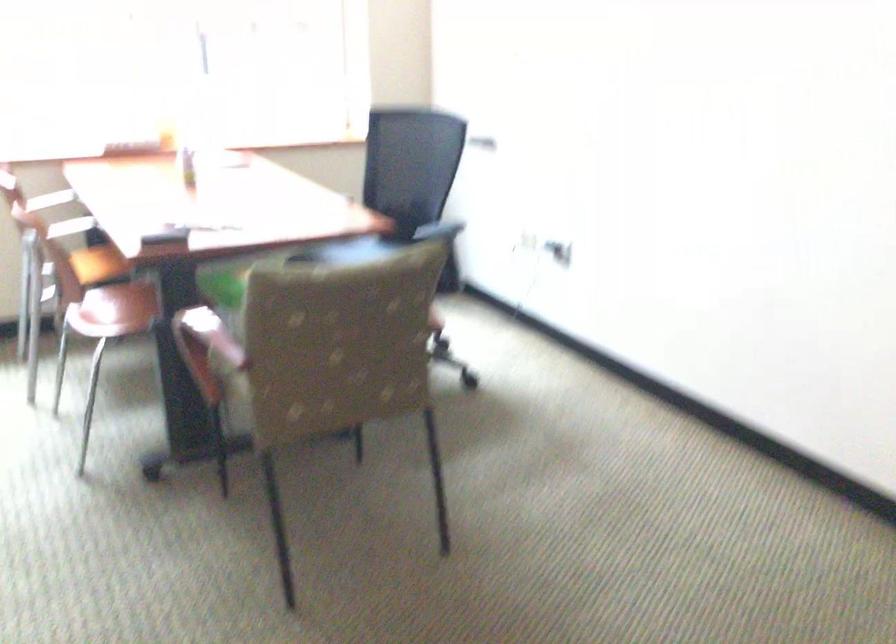
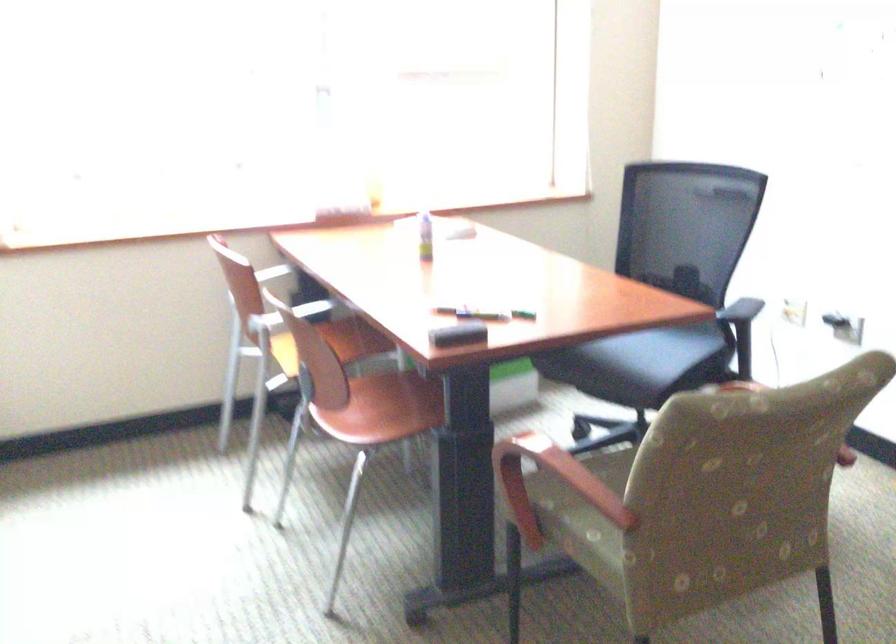
Find the pixel in the second image that matches (x=143, y=301) in the first image.

(391, 406)